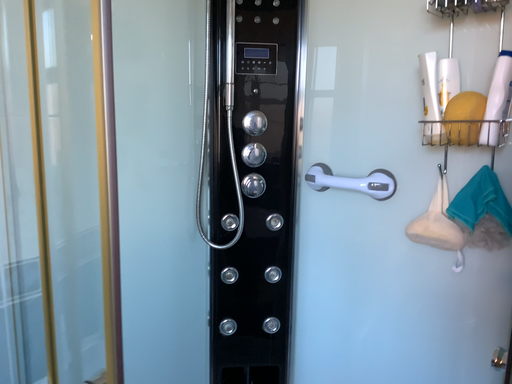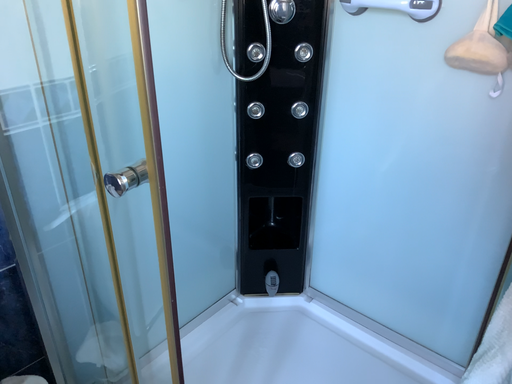
Question: How did the camera likely rotate when shooting the video?

Choices:
 (A) rotated downward
 (B) rotated upward

Answer: (A)